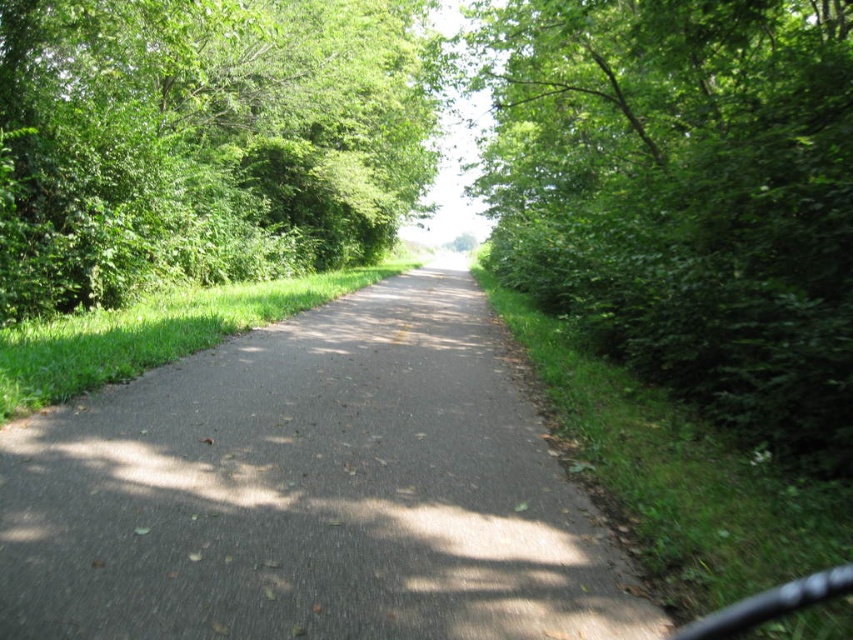
You are a hiker planning to take a photo of the green leafy tree at right and the green leafy tree at upper left from the path. Which tree should you stand closer to in order to capture both trees in the frame without moving your camera position?

You should stand closer to the green leafy tree at upper left because it is shorter than the green leafy tree at right, allowing both to fit within the camera frame when positioned appropriately.